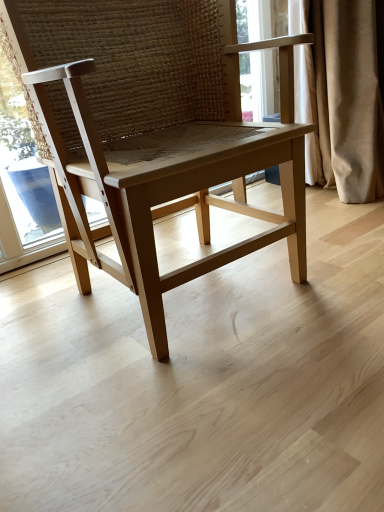
In order to face light wood chair at center, should I rotate leftwards or rightwards?

You should look left and rotate roughly 4.032 degrees.

The image size is (384, 512). Describe the element at coordinates (157, 131) in the screenshot. I see `light wood chair at center` at that location.

Locate an element on the screen. This screenshot has height=512, width=384. light wood chair at center is located at coordinates (157, 131).

The height and width of the screenshot is (512, 384). Describe the element at coordinates (343, 94) in the screenshot. I see `beige velvet curtain at right` at that location.

Identify the location of beige velvet curtain at right. The height and width of the screenshot is (512, 384). (343, 94).

I want to click on light wood chair at center, so click(x=157, y=131).

In the image, is light wood chair at center on the left side or the right side of beige velvet curtain at right?

light wood chair at center is to the left of beige velvet curtain at right.

Which object is more forward, light wood chair at center or beige velvet curtain at right?

light wood chair at center is more forward.

Considering the positions of point (290, 46) and point (307, 154), is point (290, 46) closer or farther from the camera than point (307, 154)?

Point (290, 46) appears to be closer to the viewer than point (307, 154).

From the image's perspective, would you say light wood chair at center is shown under beige velvet curtain at right?

Correct, light wood chair at center appears lower than beige velvet curtain at right in the image.

From a real-world perspective, is light wood chair at center above or below beige velvet curtain at right?

light wood chair at center is situated higher than beige velvet curtain at right in the real world.

Between light wood chair at center and beige velvet curtain at right, which one has smaller width?

Thinner between the two is beige velvet curtain at right.

Which of these two, light wood chair at center or beige velvet curtain at right, stands taller?

Standing taller between the two is light wood chair at center.

Considering the sizes of objects light wood chair at center and beige velvet curtain at right in the image provided, who is smaller, light wood chair at center or beige velvet curtain at right?

With smaller size is beige velvet curtain at right.

Is beige velvet curtain at right located within light wood chair at center?

Definitely not — beige velvet curtain at right is not inside light wood chair at center.

Is light wood chair at center placed right next to beige velvet curtain at right?

No, light wood chair at center is not with beige velvet curtain at right.

Could you tell me if light wood chair at center is facing beige velvet curtain at right?

Result: No, light wood chair at center is not aimed at beige velvet curtain at right.

Can you tell me how much light wood chair at center and beige velvet curtain at right differ in facing direction?

They differ by 2.74 degrees in their facing directions.

In order to click on curtain on the right of light wood chair at center in this screenshot , I will do `click(343, 94)`.

Considering the positions of objects beige velvet curtain at right and light wood chair at center in the image provided, who is more to the right, beige velvet curtain at right or light wood chair at center?

From the viewer's perspective, beige velvet curtain at right appears more on the right side.

In the scene shown: Between beige velvet curtain at right and light wood chair at center, which one is positioned in front?

light wood chair at center is closer to the camera.

Which point is more forward, (348, 106) or (184, 270)?

Positioned in front is point (184, 270).

From the image's perspective, would you say beige velvet curtain at right is shown under light wood chair at center?

Actually, beige velvet curtain at right appears above light wood chair at center in the image.

From a real-world perspective, is beige velvet curtain at right positioned under light wood chair at center based on gravity?

Yes, from a real-world perspective, beige velvet curtain at right is below light wood chair at center.

Consider the image. Is beige velvet curtain at right wider than light wood chair at center?

No, beige velvet curtain at right is not wider than light wood chair at center.

Which of these two, beige velvet curtain at right or light wood chair at center, stands taller?

light wood chair at center is taller.

Looking at the image, does beige velvet curtain at right seem bigger or smaller compared to light wood chair at center?

Considering their sizes, beige velvet curtain at right takes up less space than light wood chair at center.

Choose the correct answer: Is beige velvet curtain at right inside light wood chair at center or outside it?

beige velvet curtain at right is located beyond the bounds of light wood chair at center.

Is beige velvet curtain at right touching light wood chair at center?

They are not placed beside each other.

Is beige velvet curtain at right aimed at light wood chair at center?

No, beige velvet curtain at right does not turn towards light wood chair at center.

How far apart are beige velvet curtain at right and light wood chair at center?

27.70 inches.

This screenshot has height=512, width=384. Identify the location of curtain behind the light wood chair at center. (343, 94).

This screenshot has height=512, width=384. I want to click on curtain on the right of light wood chair at center, so (343, 94).

The width and height of the screenshot is (384, 512). In order to click on chair in front of the beige velvet curtain at right in this screenshot , I will do `click(157, 131)`.